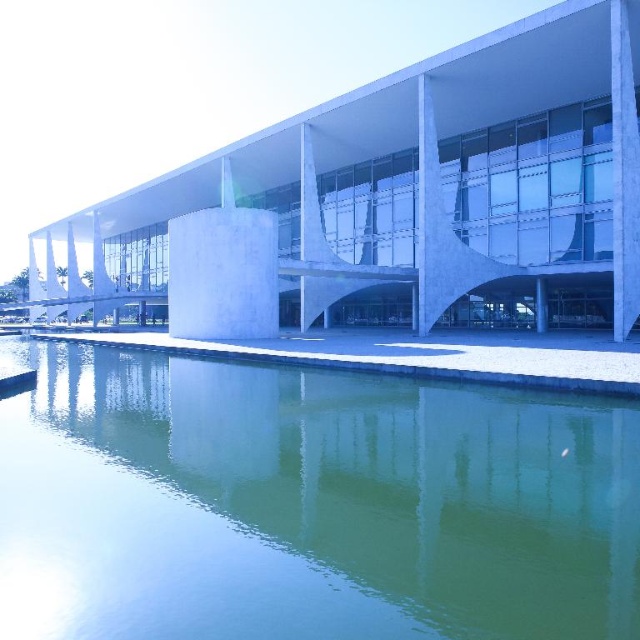
Question: Does green reflective water at center lie in front of white concrete building at center?

Choices:
 (A) yes
 (B) no

Answer: (A)

Question: Which of the following is the farthest from the observer?

Choices:
 (A) (17, 355)
 (B) (333, 106)

Answer: (B)

Question: Which object is farther from the camera taking this photo?

Choices:
 (A) white concrete building at center
 (B) green reflective water at center

Answer: (A)

Question: Is green reflective water at center below white concrete building at center?

Choices:
 (A) no
 (B) yes

Answer: (B)

Question: Does green reflective water at center have a lesser width compared to white concrete building at center?

Choices:
 (A) yes
 (B) no

Answer: (A)